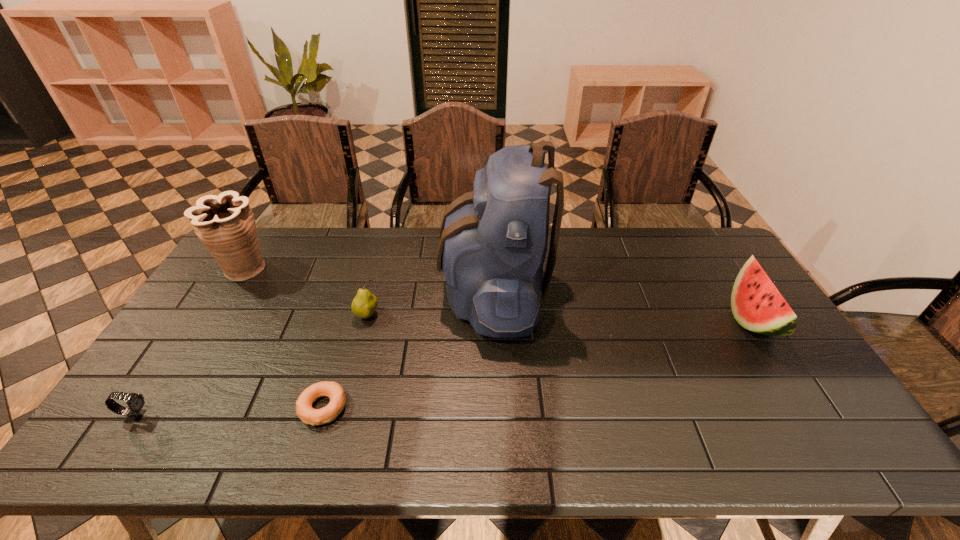
Locate an element on the screen. The height and width of the screenshot is (540, 960). vacant space located 0.220m at the front pocket of the fifth object from left to right is located at coordinates (x=372, y=291).

You are a GUI agent. You are given a task and a screenshot of the screen. Output one action in this format:
    pyautogui.click(x=<x>, y=<y>)
    Task: Click on the vacant space located on the right of the urn
    The height and width of the screenshot is (540, 960).
    Given the screenshot: What is the action you would take?
    pyautogui.click(x=380, y=270)

At what (x,y) coordinates should I click in order to perform the action: click on vacant region located on the outer rind of the watermelon. Please return your answer as a coordinate pair (x, y). The height and width of the screenshot is (540, 960). Looking at the image, I should click on (711, 319).

Where is `free space located on the outer rind of the watermelon`? This screenshot has height=540, width=960. free space located on the outer rind of the watermelon is located at coordinates (610, 319).

Where is `blank space located 0.370m on the outer rind of the watermelon`? The height and width of the screenshot is (540, 960). blank space located 0.370m on the outer rind of the watermelon is located at coordinates (607, 319).

Where is `vacant region located 0.220m on the right of the pear`? Image resolution: width=960 pixels, height=540 pixels. vacant region located 0.220m on the right of the pear is located at coordinates (453, 315).

This screenshot has height=540, width=960. Find the location of `free space located 0.140m on the face of the fifth tallest object`. free space located 0.140m on the face of the fifth tallest object is located at coordinates tap(208, 415).

Locate an element on the screen. vacant space located on the left of the shortest object is located at coordinates (275, 408).

Locate an element on the screen. backpack that is positioned at the far edge is located at coordinates (493, 241).

You are a GUI agent. You are given a task and a screenshot of the screen. Output one action in this format:
    pyautogui.click(x=<x>, y=<y>)
    Task: Click on the urn situated at the far edge
    Image resolution: width=960 pixels, height=540 pixels.
    Given the screenshot: What is the action you would take?
    pyautogui.click(x=225, y=224)